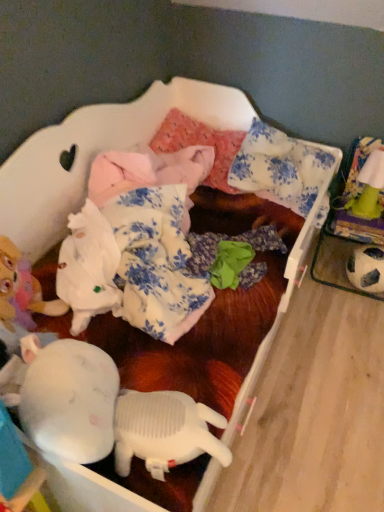
Question: From their relative heights in the image, would you say pink fabric pillow at center, the 1th pillow viewed from the left, is taller or shorter than green fabric toy at upper right, which is the second toy from bottom to top?

Choices:
 (A) tall
 (B) short

Answer: (B)

Question: Would you say pink fabric pillow at center, placed as the second pillow when sorted from right to left, is inside or outside green fabric toy at upper right, arranged as the 1th toy when viewed from the top?

Choices:
 (A) inside
 (B) outside

Answer: (B)

Question: Estimate the real-world distances between objects in this image. Which object is closer to the pink fabric pillow at center, placed as the second pillow when sorted from right to left?

Choices:
 (A) black and white textured soccer ball at right, which ranks as the 1th toy in bottom-to-top order
 (B) white floral fabric pillow at upper center, arranged as the second pillow when viewed from the left
 (C) green fabric toy at upper right, arranged as the 1th toy when viewed from the top

Answer: (B)

Question: Which is farther from the green fabric toy at upper right, arranged as the 1th toy when viewed from the top?

Choices:
 (A) black and white textured soccer ball at right, positioned as the second toy in top-to-bottom order
 (B) pink fabric pillow at center, the 1th pillow viewed from the left
 (C) white floral fabric pillow at upper center, arranged as the second pillow when viewed from the left

Answer: (B)